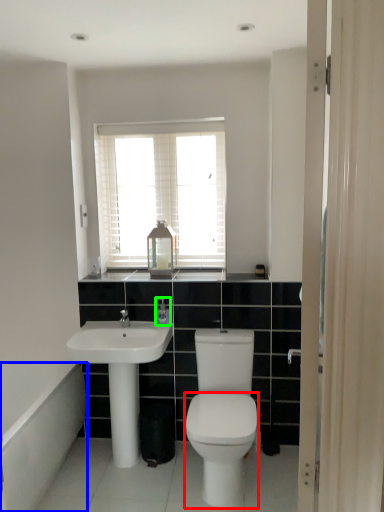
Question: Which object is positioned farthest from bidet (highlighted by a red box)? Select from bath (highlighted by a blue box) and toiletry (highlighted by a green box).

Choices:
 (A) bath
 (B) toiletry

Answer: (A)